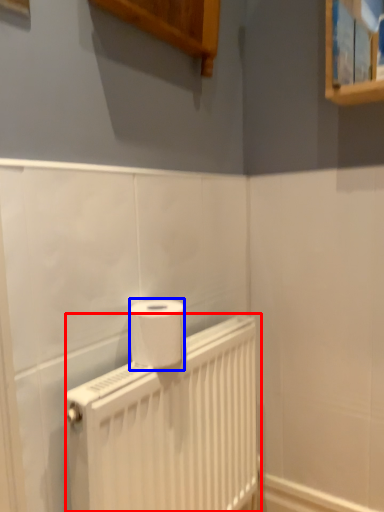
Question: Which point is closer to the camera, radiator (highlighted by a red box) or toilet paper (highlighted by a blue box)?

Choices:
 (A) radiator
 (B) toilet paper

Answer: (A)